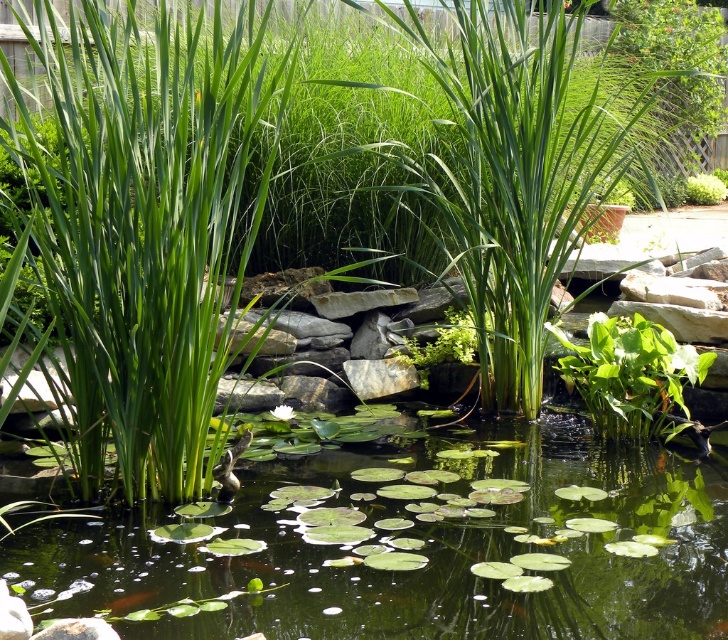
Question: Among these points, which one is nearest to the camera?

Choices:
 (A) (613, 362)
 (B) (620, 589)

Answer: (B)

Question: Can you confirm if green leafy water lilies at center is bigger than green leafy plant at center?

Choices:
 (A) yes
 (B) no

Answer: (A)

Question: Is green leafy water lilies at center above green leafy plant at center?

Choices:
 (A) no
 (B) yes

Answer: (A)

Question: Which object appears farthest from the camera in this image?

Choices:
 (A) green leafy plant at center
 (B) green leafy water lilies at center

Answer: (A)

Question: Does green leafy water lilies at center appear over green leafy plant at center?

Choices:
 (A) yes
 (B) no

Answer: (B)

Question: Which object appears farthest from the camera in this image?

Choices:
 (A) green leafy plant at center
 (B) green leafy water lilies at center

Answer: (A)